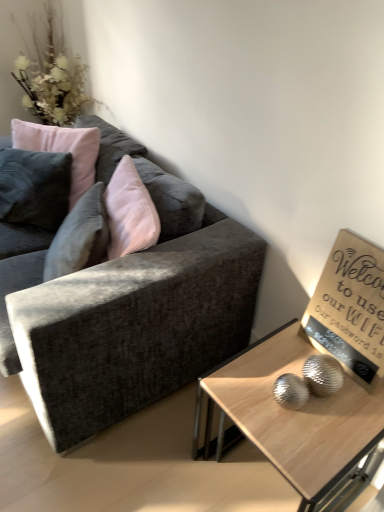
Question: From the image's perspective, is velvet pink pillow at upper left below white fluffy flowers at upper left?

Choices:
 (A) yes
 (B) no

Answer: (A)

Question: From a real-world perspective, is velvet pink pillow at upper left positioned under white fluffy flowers at upper left based on gravity?

Choices:
 (A) no
 (B) yes

Answer: (B)

Question: Does velvet pink pillow at upper left appear on the left side of white fluffy flowers at upper left?

Choices:
 (A) yes
 (B) no

Answer: (B)

Question: Considering the relative sizes of velvet pink pillow at upper left and white fluffy flowers at upper left in the image provided, is velvet pink pillow at upper left smaller than white fluffy flowers at upper left?

Choices:
 (A) yes
 (B) no

Answer: (A)

Question: Considering the relative sizes of velvet pink pillow at upper left and white fluffy flowers at upper left in the image provided, is velvet pink pillow at upper left bigger than white fluffy flowers at upper left?

Choices:
 (A) no
 (B) yes

Answer: (A)

Question: Looking at their shapes, would you say velvet pink pillow at upper left is wider or thinner than wooden glossy coffee table at lower right?

Choices:
 (A) thin
 (B) wide

Answer: (A)

Question: Is velvet pink pillow at upper left in front of or behind wooden glossy coffee table at lower right in the image?

Choices:
 (A) front
 (B) behind

Answer: (B)

Question: Based on their sizes in the image, would you say velvet pink pillow at upper left is bigger or smaller than wooden glossy coffee table at lower right?

Choices:
 (A) big
 (B) small

Answer: (B)

Question: Considering the relative positions of velvet pink pillow at upper left and wooden glossy coffee table at lower right in the image provided, is velvet pink pillow at upper left to the left or to the right of wooden glossy coffee table at lower right?

Choices:
 (A) left
 (B) right

Answer: (A)

Question: In the image, is velvet dark gray couch at left on the left side or the right side of white fluffy flowers at upper left?

Choices:
 (A) left
 (B) right

Answer: (B)

Question: From their relative heights in the image, would you say velvet dark gray couch at left is taller or shorter than white fluffy flowers at upper left?

Choices:
 (A) short
 (B) tall

Answer: (A)

Question: Is velvet dark gray couch at left inside or outside of white fluffy flowers at upper left?

Choices:
 (A) inside
 (B) outside

Answer: (B)

Question: Is point (81, 309) closer or farther from the camera than point (56, 59)?

Choices:
 (A) closer
 (B) farther

Answer: (A)

Question: Does point (375, 256) appear closer or farther from the camera than point (175, 197)?

Choices:
 (A) farther
 (B) closer

Answer: (B)

Question: Would you say wooden sign at upper right is inside or outside velvet dark gray couch at left?

Choices:
 (A) inside
 (B) outside

Answer: (B)